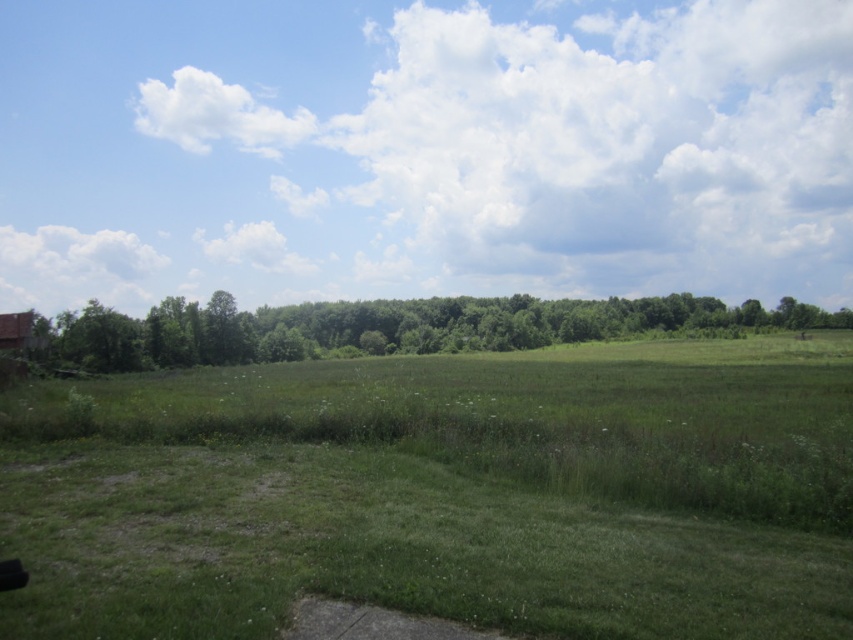
Which is more to the left, green grassy pasture at center or green leafy trees at center?

Positioned to the left is green grassy pasture at center.

Which is in front, point (657, 358) or point (248, 353)?

Point (657, 358) is more forward.

Find the location of a particular element. green grassy pasture at center is located at coordinates (445, 493).